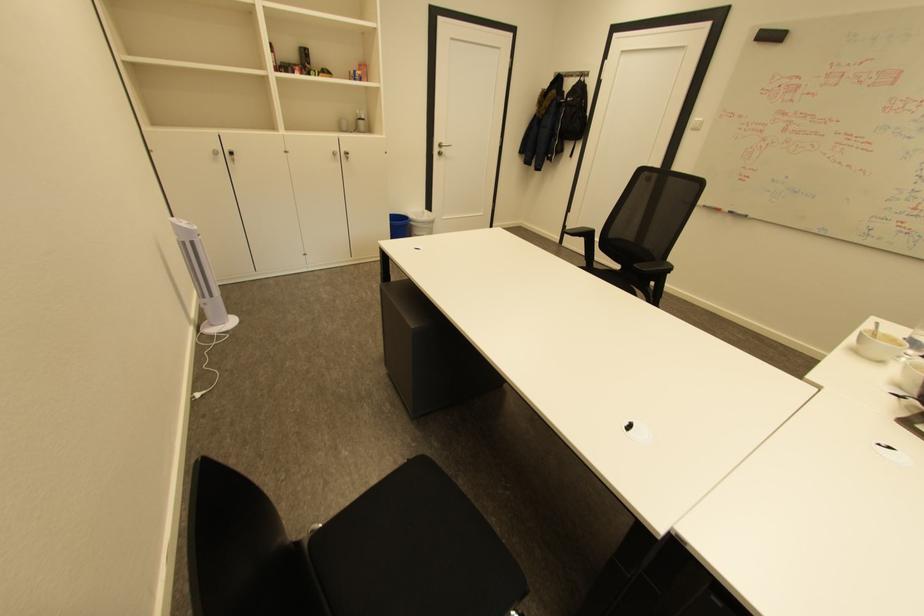
At what (x,y) coordinates should I click in order to perform the action: click on red whiteboard marker. Please return your answer as a coordinate pair (x, y). Looking at the image, I should click on [x=825, y=130].